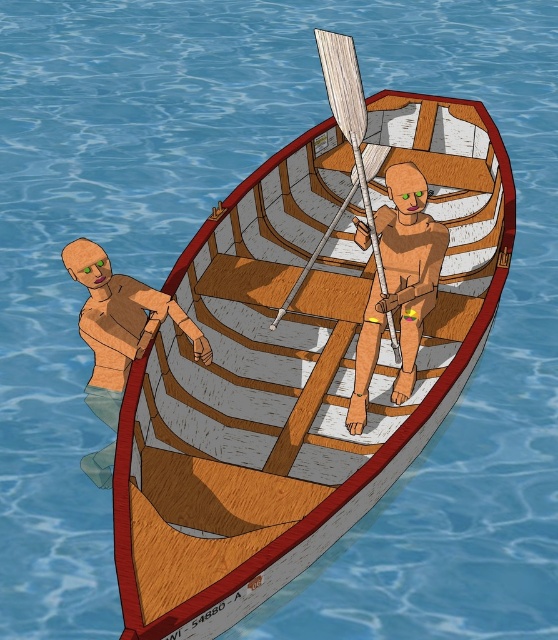
Based on the photo, between wooden boat at center and wooden man at left, which one appears on the right side from the viewer's perspective?

wooden boat at center

Image resolution: width=558 pixels, height=640 pixels. Describe the element at coordinates (299, 365) in the screenshot. I see `wooden boat at center` at that location.

You are a GUI agent. You are given a task and a screenshot of the screen. Output one action in this format:
    pyautogui.click(x=<x>, y=<y>)
    Task: Click on the wooden boat at center
    
    Given the screenshot: What is the action you would take?
    pyautogui.click(x=299, y=365)

Which is behind, point (403, 316) or point (378, 257)?

Positioned behind is point (403, 316).

Which is in front, point (437, 413) or point (358, 134)?

Point (358, 134)

Image resolution: width=558 pixels, height=640 pixels. I want to click on wooden boat at center, so click(299, 365).

Does wooden boat at center have a lesser height compared to wooden oar at center?

No.

Does wooden boat at center appear under wooden oar at center?

Actually, wooden boat at center is above wooden oar at center.

You are a GUI agent. You are given a task and a screenshot of the screen. Output one action in this format:
    pyautogui.click(x=<x>, y=<y>)
    Task: Click on the wooden boat at center
    The image size is (558, 640).
    Given the screenshot: What is the action you would take?
    pyautogui.click(x=299, y=365)

Find the location of `wooden boat at center`. wooden boat at center is located at coordinates (299, 365).